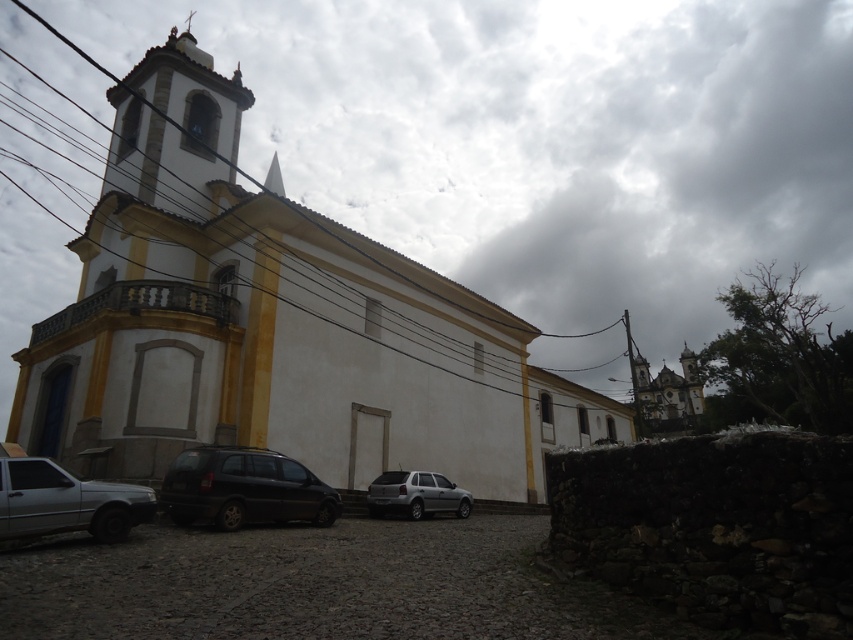
Does point (126, 179) lie behind point (466, 515)?

Yes, it is behind point (466, 515).

Who is positioned more to the right, white smooth church at center or satin silver suv at center?

From the viewer's perspective, satin silver suv at center appears more on the right side.

Does point (218, 374) come closer to viewer compared to point (381, 509)?

No.

The image size is (853, 640). What are the coordinates of `white smooth church at center` in the screenshot? It's located at (271, 321).

Can you confirm if black matte van at lower left is shorter than satin silver suv at center?

No, black matte van at lower left is not shorter than satin silver suv at center.

Is black matte van at lower left smaller than satin silver suv at center?

No.

Describe the element at coordinates (244, 488) in the screenshot. I see `black matte van at lower left` at that location.

The image size is (853, 640). What are the coordinates of `black matte van at lower left` in the screenshot? It's located at (244, 488).

Does white smooth church at center have a larger size compared to silver metallic car at lower left?

Yes, white smooth church at center is bigger than silver metallic car at lower left.

Can you confirm if white smooth church at center is positioned above silver metallic car at lower left?

Indeed, white smooth church at center is positioned over silver metallic car at lower left.

This screenshot has height=640, width=853. I want to click on white smooth church at center, so click(x=271, y=321).